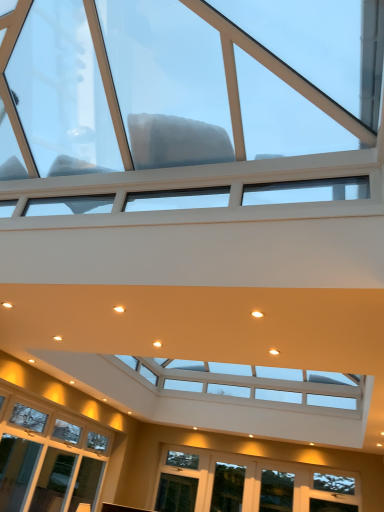
Question: Is point (231, 467) closer or farther from the camera than point (268, 507)?

Choices:
 (A) closer
 (B) farther

Answer: (B)

Question: Which is correct: clear glass window at lower center, arranged as the 1th window when viewed from the back, is inside clear glass window at lower center, the second window when ordered from back to front, or outside of it?

Choices:
 (A) outside
 (B) inside

Answer: (A)

Question: Based on their relative distances, which object is nearer to the clear glass window at lower center, which appears as the 3th window when viewed from the top?

Choices:
 (A) clear glass window at lower center, the second window in the front-to-back sequence
 (B) transparent glass window at upper center, which is counted as the 1th window, starting from the top

Answer: (A)

Question: Considering the real-world distances, which object is closest to the clear glass window at lower center, which ranks as the third window in front-to-back order?

Choices:
 (A) clear glass window at lower center, the second window in the front-to-back sequence
 (B) transparent glass window at upper center, which is counted as the third window, starting from the bottom

Answer: (A)